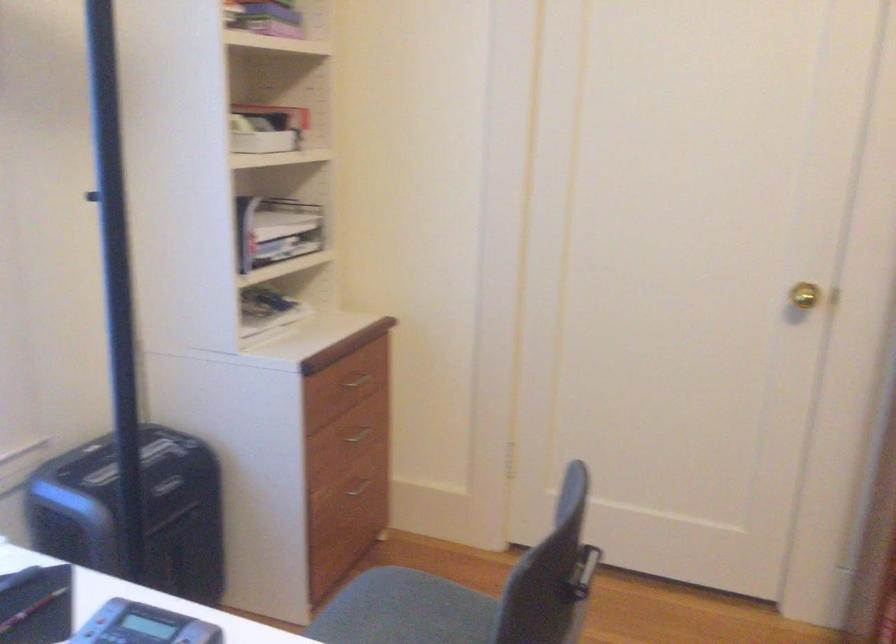
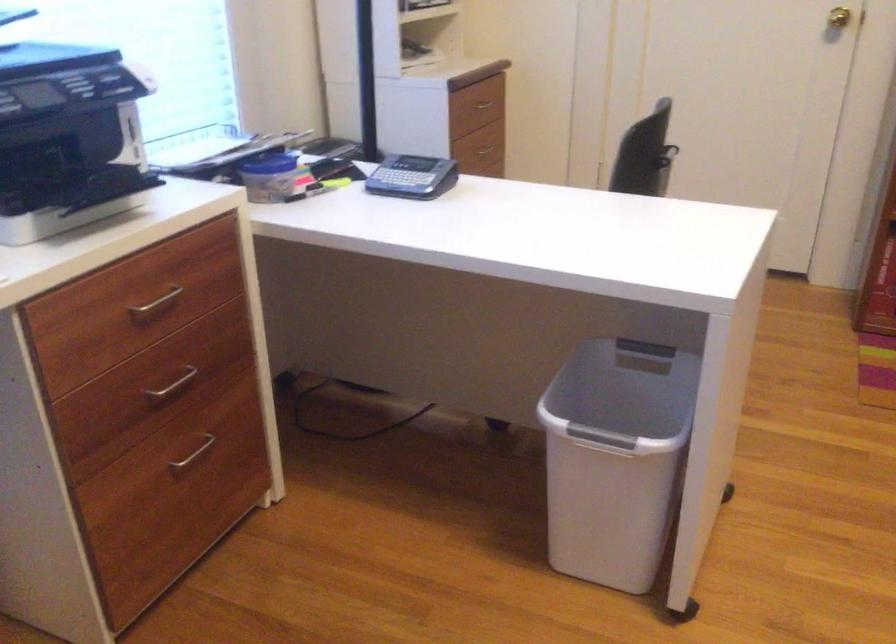
Locate, in the second image, the point that corresponds to point (368, 436) in the first image.

(486, 149)